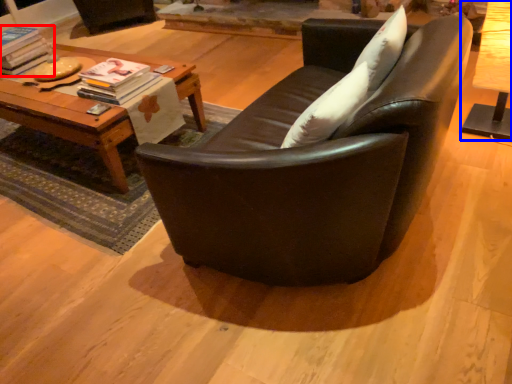
Question: Which of the following is the farthest to the observer, magazine (highlighted by a red box) or table (highlighted by a blue box)?

Choices:
 (A) magazine
 (B) table

Answer: (A)